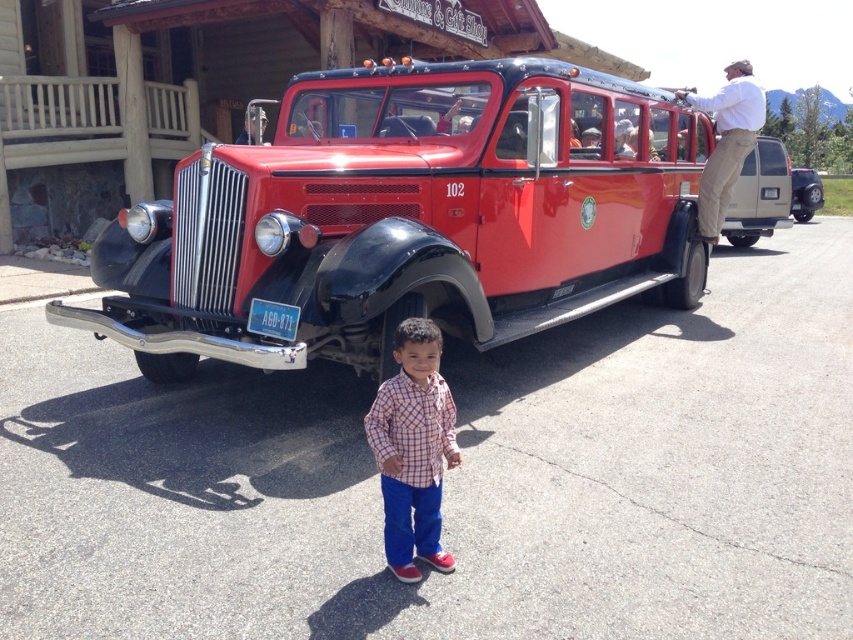
You are a photographer trying to capture both the shiny red bus at center and the plaid shirt at center in a single frame. Considering their positions, which object should you position closer to the camera to ensure both fit in the photo?

The shiny red bus at center is wider than the plaid shirt at center, so you should position the plaid shirt at center closer to the camera to ensure both fit in the photo.

Consider the image. You are standing at the point marked by the coordinates point (408, 218). What object is exactly at that location?

The shiny red bus at center is located at point (408, 218).

Based on the scene, can you determine if the shiny red bus at center is positioned higher than the plaid shirt at center?

The shiny red bus at center is located above the plaid shirt at center, so yes, it is positioned higher.